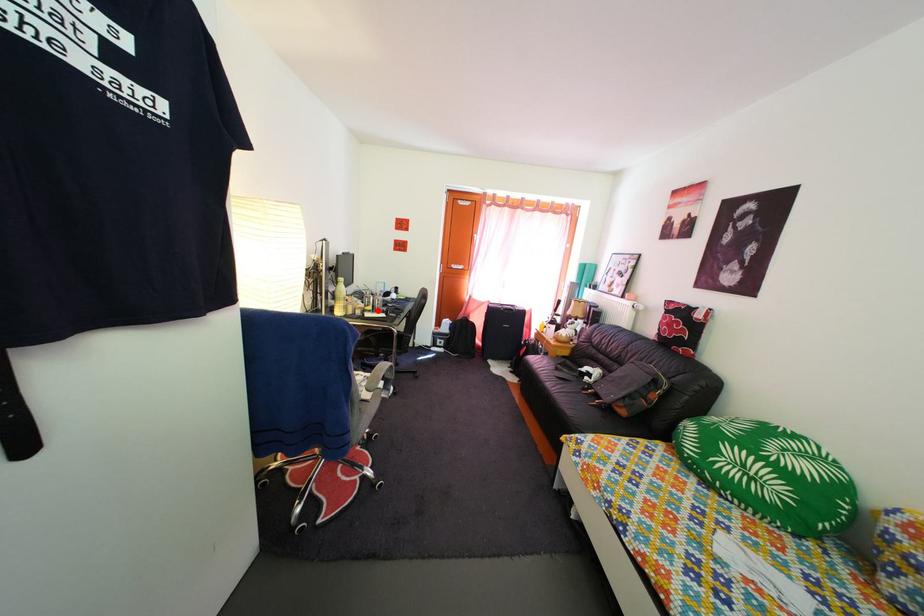
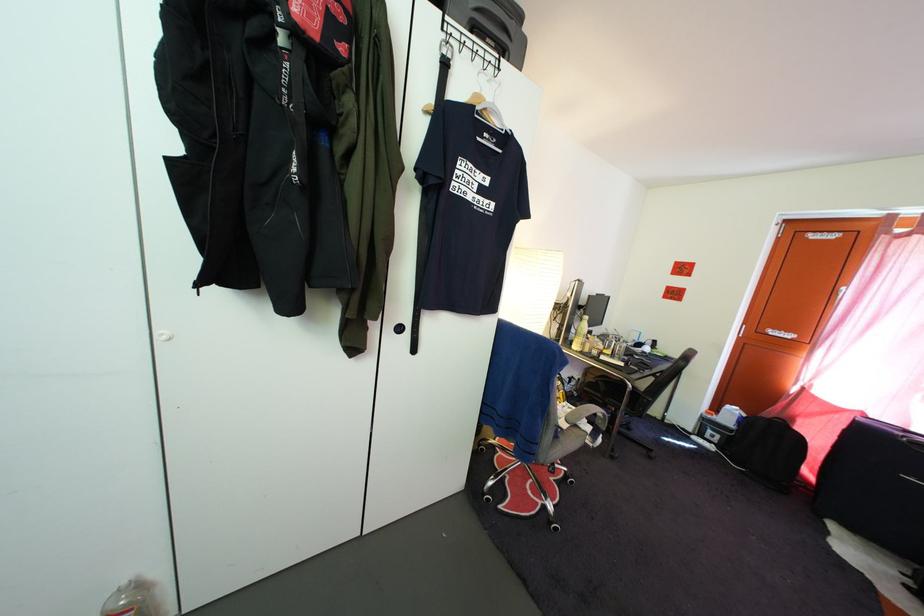
The point at the highlighted location is marked in the first image. Where is the corresponding point in the second image?

(618, 354)